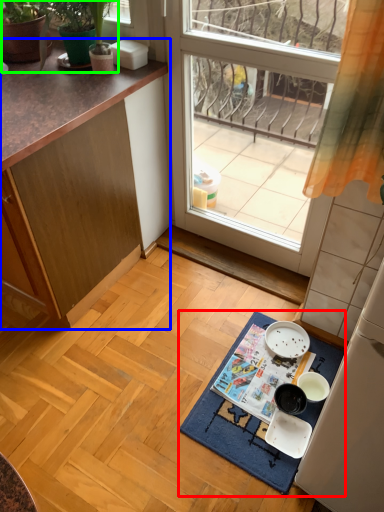
Question: Considering the real-world distances, which object is closest to bath mat (highlighted by a red box)? cabinetry (highlighted by a blue box) or plant (highlighted by a green box).

Choices:
 (A) cabinetry
 (B) plant

Answer: (A)